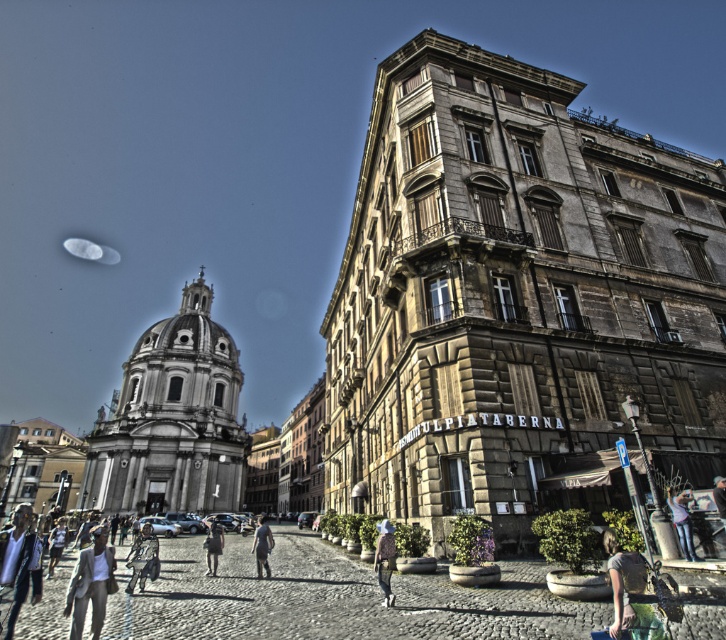
You are a tourist standing at the center of the square, wanting to take a photo that includes both the grand domed building and the multi story building with balconies. However, you have a metallic silver bicycle at lower left and a denim jacket at lower right in your view. Which object should you move to make space for both buildings in your photo?

The metallic silver bicycle at lower left is larger in size than the denim jacket at lower right, so you should move the metallic silver bicycle at lower left to make more space for both buildings in your photo.

You are a fashion designer observing a model wearing a denim jacket at lower center and light gray fabric pants at center. Which clothing item is shorter in length?

The denim jacket at lower center has a lesser height compared to light gray fabric pants at center, so the denim jacket is shorter in length.